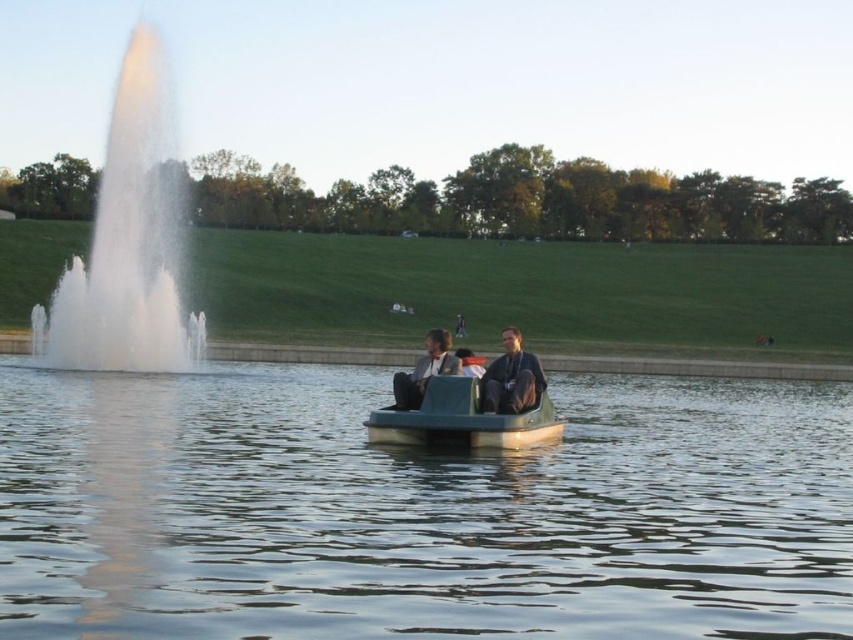
Question: Which of the following is the closest to the observer?

Choices:
 (A) (138, 186)
 (B) (541, 376)
 (C) (445, 380)

Answer: (C)

Question: Which is farther from the green smooth water at center?

Choices:
 (A) white frothy water at left
 (B) dark gray fabric jacket at center
 (C) matte black boat at center

Answer: (A)

Question: Does green smooth water at center have a lesser width compared to matte gray jacket at center?

Choices:
 (A) yes
 (B) no

Answer: (B)

Question: Among these objects, which one is nearest to the camera?

Choices:
 (A) green matte boat at center
 (B) white frothy water at left
 (C) matte black boat at center

Answer: (A)

Question: Is white frothy water at left wider than dark gray fabric jacket at center?

Choices:
 (A) yes
 (B) no

Answer: (A)

Question: Does green smooth water at center appear under matte gray jacket at center?

Choices:
 (A) yes
 (B) no

Answer: (A)